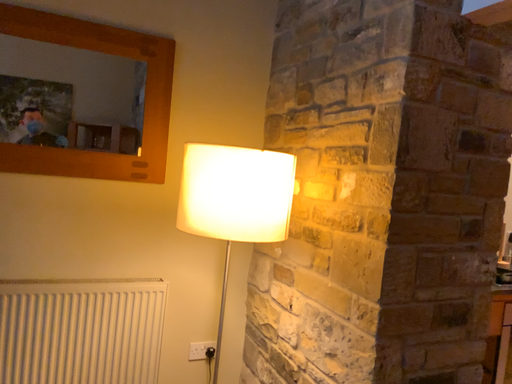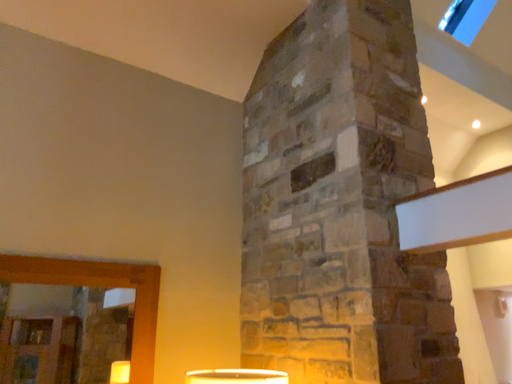
Question: How did the camera likely rotate when shooting the video?

Choices:
 (A) rotated left
 (B) rotated right

Answer: (B)